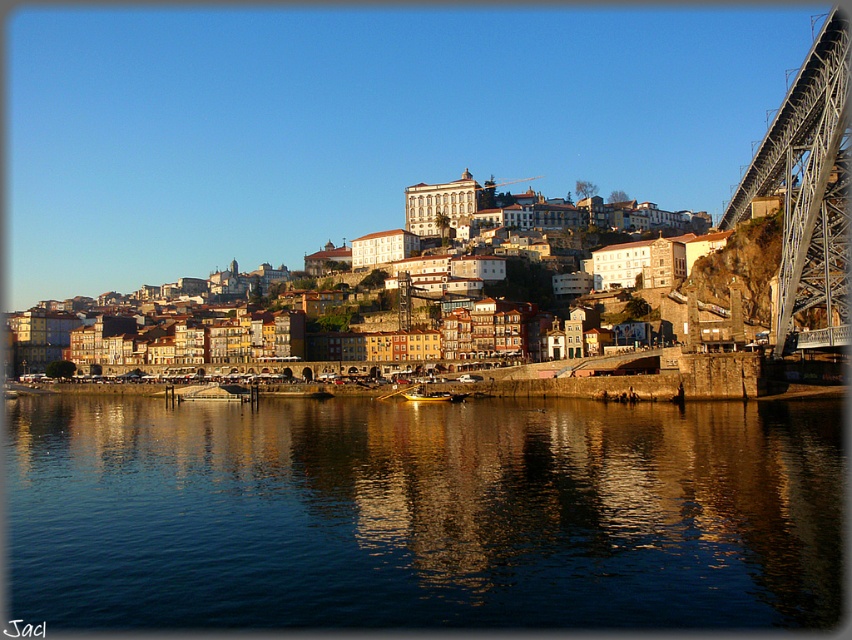
Which is in front, point (235, 600) or point (822, 195)?

Positioned in front is point (235, 600).

Is dark blue water at lower center thinner than metallic steel bridge at right?

In fact, dark blue water at lower center might be wider than metallic steel bridge at right.

Image resolution: width=852 pixels, height=640 pixels. What do you see at coordinates (423, 513) in the screenshot?
I see `dark blue water at lower center` at bounding box center [423, 513].

At what (x,y) coordinates should I click in order to perform the action: click on dark blue water at lower center. Please return your answer as a coordinate pair (x, y). Looking at the image, I should click on click(423, 513).

Which of these two, dark blue water at lower center or multicolored stone buildings at center, stands taller?

multicolored stone buildings at center is taller.

Based on the photo, does dark blue water at lower center have a larger size compared to multicolored stone buildings at center?

Incorrect, dark blue water at lower center is not larger than multicolored stone buildings at center.

Who is more distant from viewer, (x=820, y=547) or (x=672, y=237)?

Point (x=672, y=237)

Find the location of a particular element. dark blue water at lower center is located at coordinates 423,513.

Between multicolored stone buildings at center and metallic steel bridge at right, which one has more height?

Standing taller between the two is multicolored stone buildings at center.

Identify the location of multicolored stone buildings at center. (516, 228).

Between point (433, 268) and point (738, 196), which one is positioned in front?

Point (738, 196)

This screenshot has height=640, width=852. I want to click on multicolored stone buildings at center, so click(x=516, y=228).